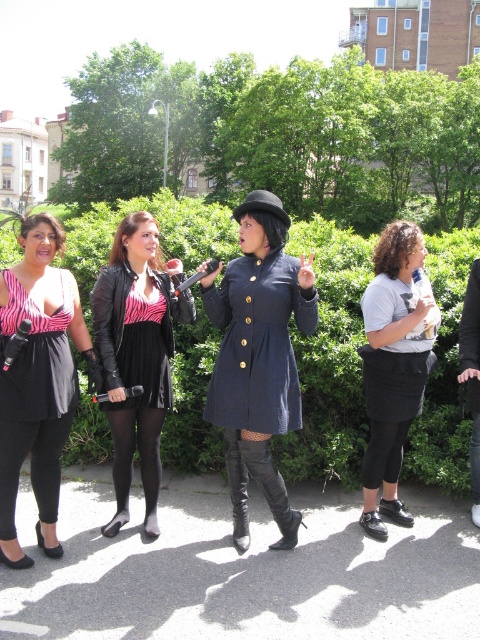
You are a photographer trying to capture a candid shot of the leather jacket at center and the black leather jacket at left. Which jacket should you focus on first if you want to ensure both are in frame without moving the camera?

The leather jacket at center is positioned under the black leather jacket at left, so you should focus on the black leather jacket at left first to ensure both are visible in the frame.

You are a photographer at this event and want to frame both the matte navy coat at center and the pink zebra print dress at left in your shot. Given their sizes, which one should you focus on to ensure both fit well in the frame?

The matte navy coat at center is larger in size than the pink zebra print dress at left, so focusing on the matte navy coat at center will help ensure both fit well in the frame.